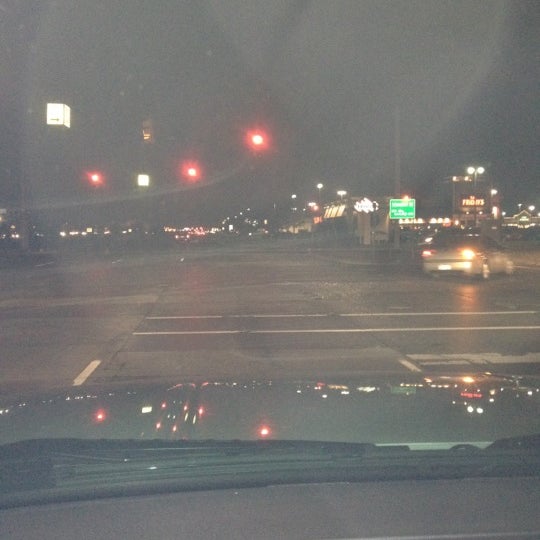
Mark all positions containing welcome to.... sign in the image. Your answer should be formatted as a list of tuples, i.e. [(x1, y1), (x2, y2), ...], where each tuple contains the x and y coordinates of a point satisfying the conditions above.

[(400, 211)]